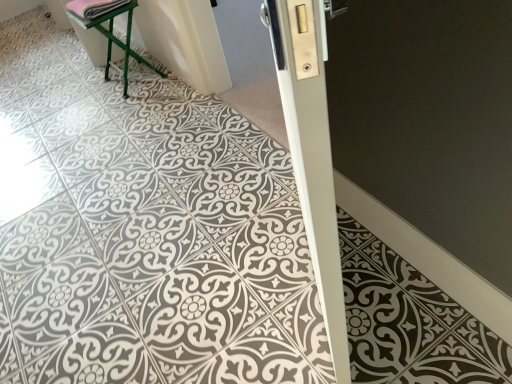
Question: Is pink fabric at upper left aimed at white glossy door at center?

Choices:
 (A) yes
 (B) no

Answer: (B)

Question: Is pink fabric at upper left not within white glossy door at center?

Choices:
 (A) yes
 (B) no

Answer: (A)

Question: Does pink fabric at upper left have a lesser width compared to white glossy door at center?

Choices:
 (A) no
 (B) yes

Answer: (A)

Question: From a real-world perspective, does pink fabric at upper left stand above white glossy door at center?

Choices:
 (A) no
 (B) yes

Answer: (A)

Question: Can you confirm if pink fabric at upper left is positioned to the left of white glossy door at center?

Choices:
 (A) yes
 (B) no

Answer: (A)

Question: From the image's perspective, is green metal stool at upper left above or below white glossy door at center?

Choices:
 (A) below
 (B) above

Answer: (B)

Question: Considering the positions of point (126, 43) and point (316, 16), is point (126, 43) closer or farther from the camera than point (316, 16)?

Choices:
 (A) closer
 (B) farther

Answer: (B)

Question: Considering the positions of green metal stool at upper left and white glossy door at center in the image, is green metal stool at upper left wider or thinner than white glossy door at center?

Choices:
 (A) thin
 (B) wide

Answer: (B)

Question: Considering the relative positions of green metal stool at upper left and white glossy door at center in the image provided, is green metal stool at upper left to the left or to the right of white glossy door at center?

Choices:
 (A) right
 (B) left

Answer: (B)

Question: Is pink fabric at upper left taller or shorter than green metal stool at upper left?

Choices:
 (A) tall
 (B) short

Answer: (B)

Question: Relative to green metal stool at upper left, is pink fabric at upper left in front or behind?

Choices:
 (A) behind
 (B) front

Answer: (B)

Question: From a real-world perspective, is pink fabric at upper left physically located above or below green metal stool at upper left?

Choices:
 (A) below
 (B) above

Answer: (B)

Question: Looking at their shapes, would you say pink fabric at upper left is wider or thinner than green metal stool at upper left?

Choices:
 (A) wide
 (B) thin

Answer: (B)

Question: Relative to pink fabric at upper left, is green metal stool at upper left in front or behind?

Choices:
 (A) behind
 (B) front

Answer: (A)

Question: From the image's perspective, is green metal stool at upper left above or below pink fabric at upper left?

Choices:
 (A) above
 (B) below

Answer: (B)